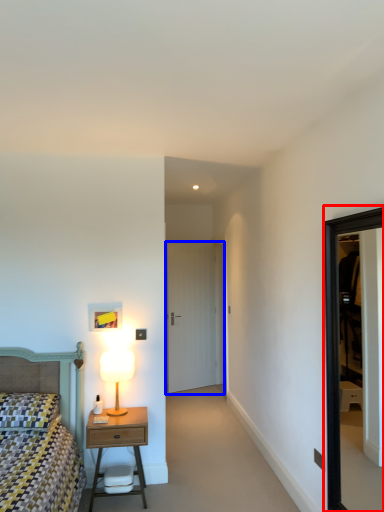
Question: Which point is closer to the camera, window (highlighted by a red box) or door (highlighted by a blue box)?

Choices:
 (A) window
 (B) door

Answer: (A)